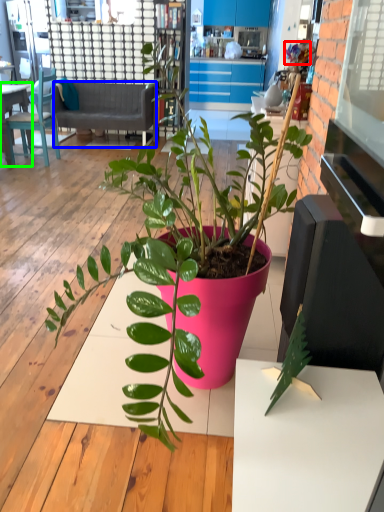
Question: Considering the real-world distances, which object is closest to flower (highlighted by a red box)? studio couch (highlighted by a blue box) or desk (highlighted by a green box).

Choices:
 (A) studio couch
 (B) desk

Answer: (A)